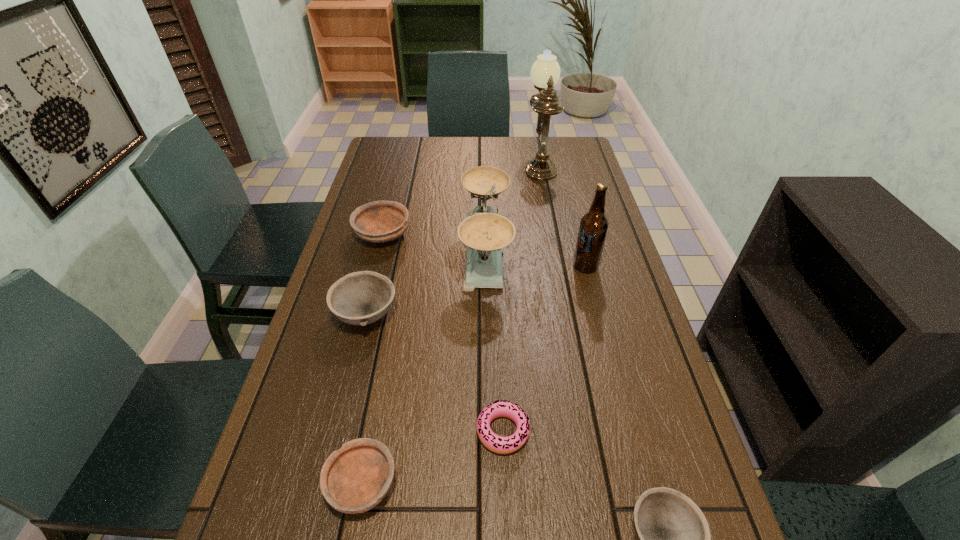
The image size is (960, 540). Identify the location of doughnut. (502, 445).

Locate an element on the screen. pink doughnut is located at coordinates (502, 445).

Locate an element on the screen. vacant region located 0.260m on the front of the farthest object is located at coordinates (551, 223).

Find the location of `free region located on the label of the second tallest object`. free region located on the label of the second tallest object is located at coordinates (484, 266).

You are a GUI agent. You are given a task and a screenshot of the screen. Output one action in this format:
    pyautogui.click(x=<x>, y=<y>)
    Task: Click on the free point located 0.350m on the label of the second tallest object
    
    Given the screenshot: What is the action you would take?
    pyautogui.click(x=453, y=266)

You are a GUI agent. You are given a task and a screenshot of the screen. Output one action in this format:
    pyautogui.click(x=<x>, y=<y>)
    Task: Click on the free region located 0.210m on the label of the second tallest object
    Image resolution: width=960 pixels, height=540 pixels.
    Given the screenshot: What is the action you would take?
    pyautogui.click(x=501, y=266)

Locate an element on the screen. This screenshot has width=960, height=540. vacant space situated on the front-facing side of the sixth shortest object is located at coordinates (x=385, y=252).

You are a GUI agent. You are given a task and a screenshot of the screen. Output one action in this format:
    pyautogui.click(x=<x>, y=<y>)
    Task: Click on the free spot located 0.110m on the front-facing side of the sixth shortest object
    
    Given the screenshot: What is the action you would take?
    pyautogui.click(x=424, y=252)

Where is `vacant space located 0.210m on the front-facing side of the sixth shortest object`? The image size is (960, 540). vacant space located 0.210m on the front-facing side of the sixth shortest object is located at coordinates (391, 252).

This screenshot has width=960, height=540. In order to click on vacant position located 0.070m on the right of the left gray bowl in this screenshot , I will do `click(425, 315)`.